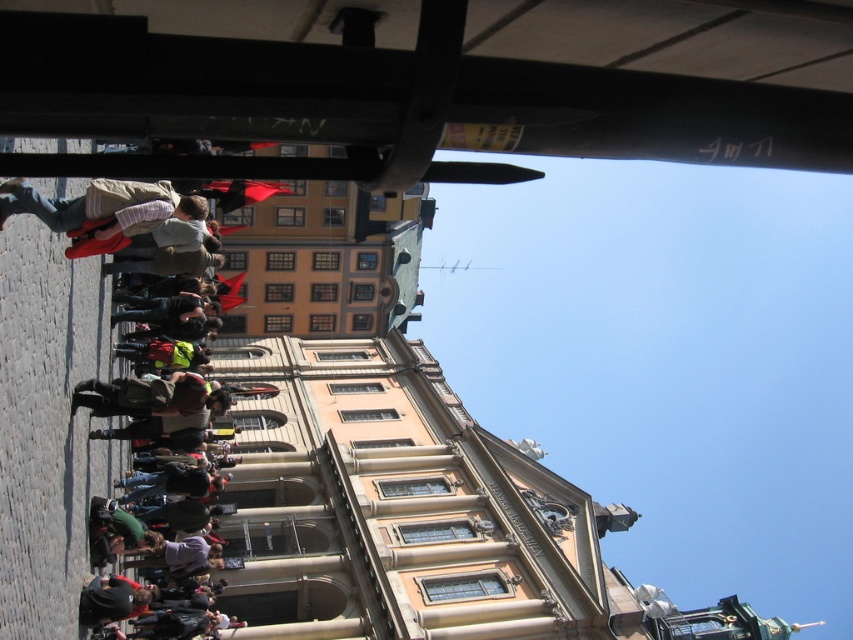
You are a photographer standing at the front of the historic building. You want to take a photo that includes both the metallic black canopy at upper center and the striped shirt at left. Based on their positions, which object should you adjust your camera to focus on first to ensure both are in the frame?

The metallic black canopy at upper center is positioned on the right side of striped shirt at left. To include both in the frame, you should first focus on the striped shirt at left, as it is on the left side, ensuring there is enough space to capture the canopy on its right.

You are standing at the base of the historic building and want to place a 20 meter long banner between the metallic black canopy at upper center and the nearest red flag. Can you fit the banner between them?

The distance between the metallic black canopy at upper center and the nearest red flag is 23.18 meters. Since the banner is only 20 meters long, it can fit comfortably between them with 3.18 meters of space remaining.